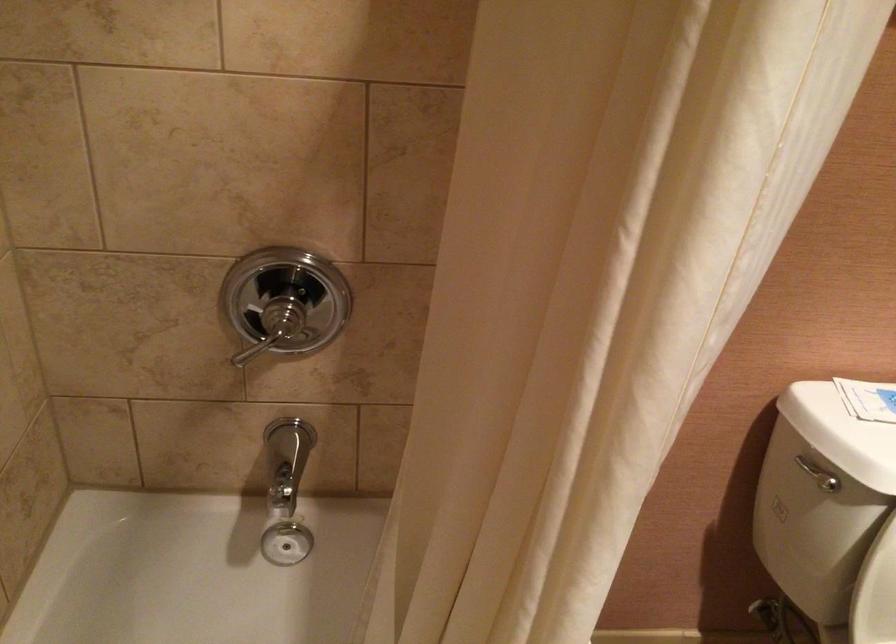
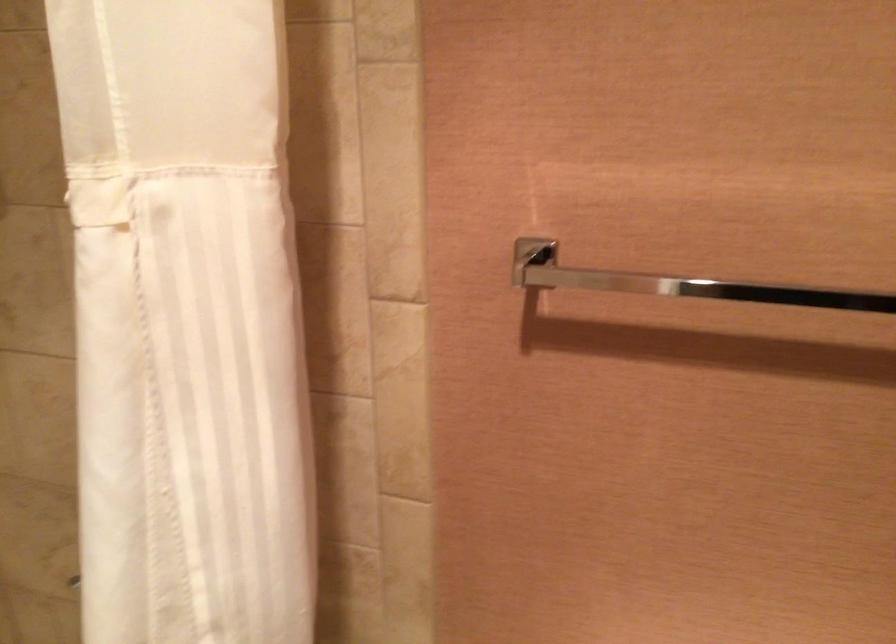
Question: How did the camera likely rotate?

Choices:
 (A) Left
 (B) Right
 (C) Up
 (D) Down

Answer: (A)